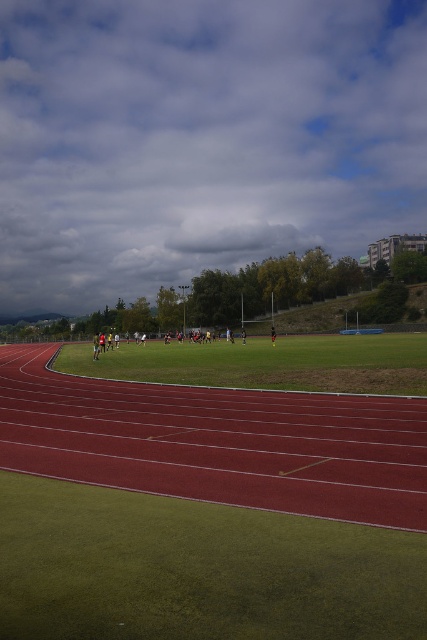
Question: Where is green grass football field at center located in relation to green grass field at center in the image?

Choices:
 (A) left
 (B) right

Answer: (A)

Question: Which point appears farthest from the camera in this image?

Choices:
 (A) (184, 420)
 (B) (211, 352)

Answer: (B)

Question: In this image, where is green grass football field at center located relative to green grass field at center?

Choices:
 (A) above
 (B) below

Answer: (A)

Question: Can you confirm if green grass football field at center is positioned below green grass field at center?

Choices:
 (A) no
 (B) yes

Answer: (A)

Question: Which point is closer to the camera?

Choices:
 (A) green grass field at center
 (B) green grass football field at center

Answer: (B)